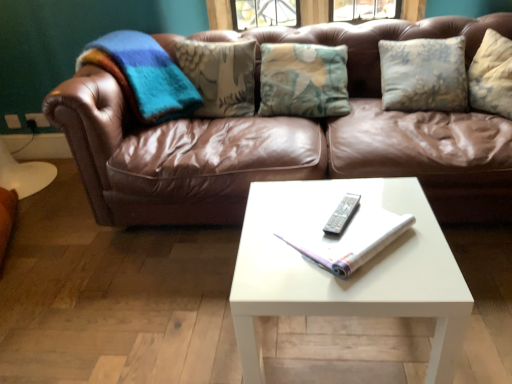
Question: Is white paper book at center closer to camera compared to brown leather couch at center?

Choices:
 (A) yes
 (B) no

Answer: (A)

Question: Is white paper book at center not near brown leather couch at center?

Choices:
 (A) yes
 (B) no

Answer: (B)

Question: Can you confirm if white paper book at center is positioned to the right of brown leather couch at center?

Choices:
 (A) no
 (B) yes

Answer: (A)

Question: Can you confirm if white paper book at center is smaller than brown leather couch at center?

Choices:
 (A) no
 (B) yes

Answer: (B)

Question: From the image's perspective, is white paper book at center located above brown leather couch at center?

Choices:
 (A) yes
 (B) no

Answer: (B)

Question: From a real-world perspective, is white glossy coffee table at center above or below silver metallic remote at center?

Choices:
 (A) above
 (B) below

Answer: (B)

Question: Based on their sizes in the image, would you say white glossy coffee table at center is bigger or smaller than silver metallic remote at center?

Choices:
 (A) big
 (B) small

Answer: (A)

Question: Is point (410, 233) closer or farther from the camera than point (324, 230)?

Choices:
 (A) farther
 (B) closer

Answer: (B)

Question: Would you say white glossy coffee table at center is to the left or to the right of silver metallic remote at center in the picture?

Choices:
 (A) left
 (B) right

Answer: (A)

Question: Is white paper book at center in front of or behind silver metallic remote at center in the image?

Choices:
 (A) behind
 (B) front

Answer: (B)

Question: From a real-world perspective, relative to silver metallic remote at center, is white paper book at center vertically above or below?

Choices:
 (A) above
 (B) below

Answer: (A)

Question: Looking at their shapes, would you say white paper book at center is wider or thinner than silver metallic remote at center?

Choices:
 (A) thin
 (B) wide

Answer: (B)

Question: Is white paper book at center taller or shorter than silver metallic remote at center?

Choices:
 (A) tall
 (B) short

Answer: (A)

Question: Considering the positions of silver metallic remote at center and white glossy coffee table at center in the image, is silver metallic remote at center wider or thinner than white glossy coffee table at center?

Choices:
 (A) thin
 (B) wide

Answer: (A)

Question: From the image's perspective, is silver metallic remote at center located above or below white glossy coffee table at center?

Choices:
 (A) below
 (B) above

Answer: (B)